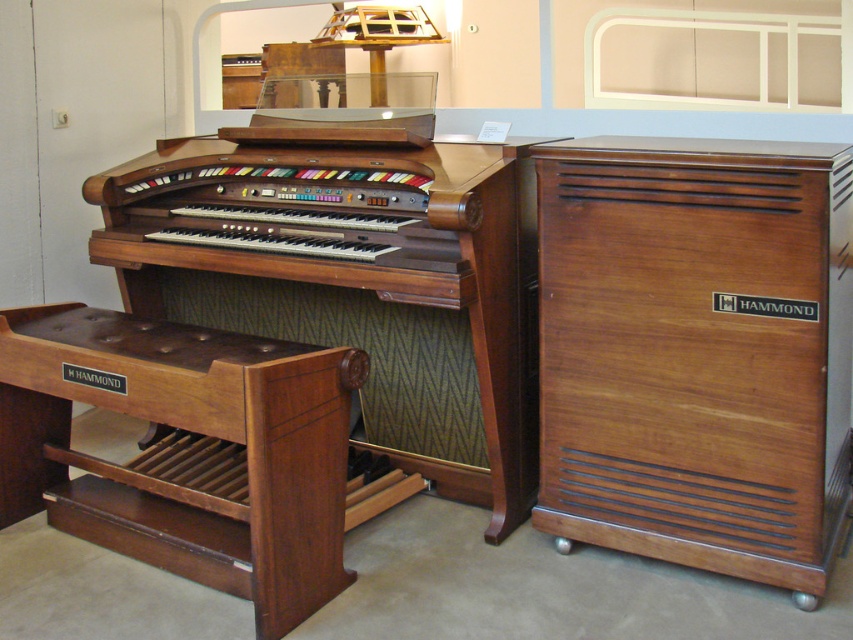
Consider the image. You are a musician who wants to sit on the brown polished wood stool at lower left to play the wooden polished organ at center. Is the stool large enough to comfortably sit on while reaching the organ?

The wooden polished organ at center is bigger than the brown polished wood stool at lower left. Since the stool is smaller, it might be appropriately sized for sitting comfortably while reaching the organ, but the exact comfort depends on the user.

You are standing in front of the vintage Hammond organ and notice two points marked on its surface. The first point is at coordinates point (x=137, y=248) and the second at point (x=317, y=353). Which of these points is closer to you?

Point (x=137, y=248) is further to the viewer than point (x=317, y=353). Wait, the question asks which is closer. So the answer would be point (x=317, y=353) is closer because it is less further? Hmm, need to clarify. The description says point A is further than point B. So point B is closer. So the answer is point (x=317, y=353) is closer to you.

You are a musician preparing to play the wooden polished organ at center. You see the brown polished wood stool at lower left. Where is the stool located relative to the organ?

The brown polished wood stool at lower left is behind the wooden polished organ at center.